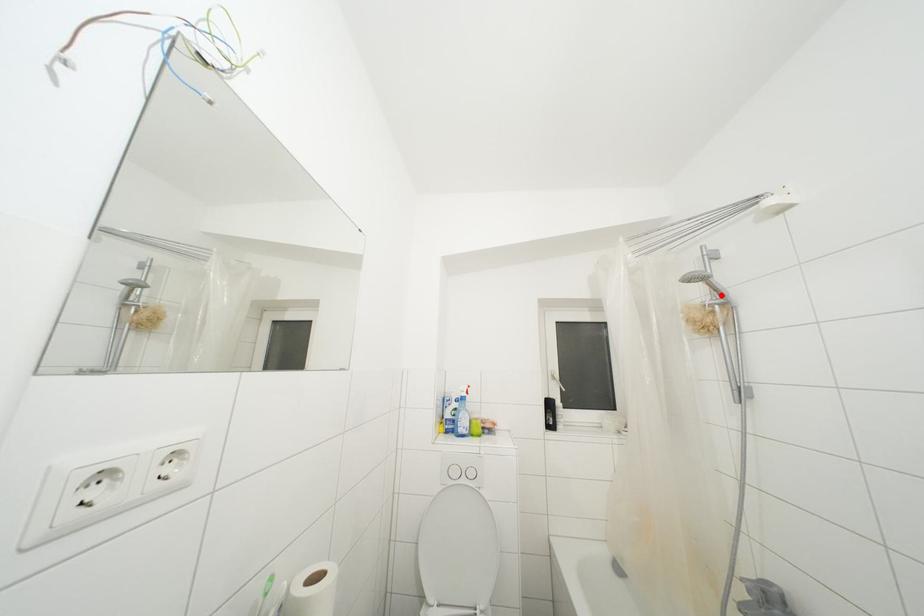
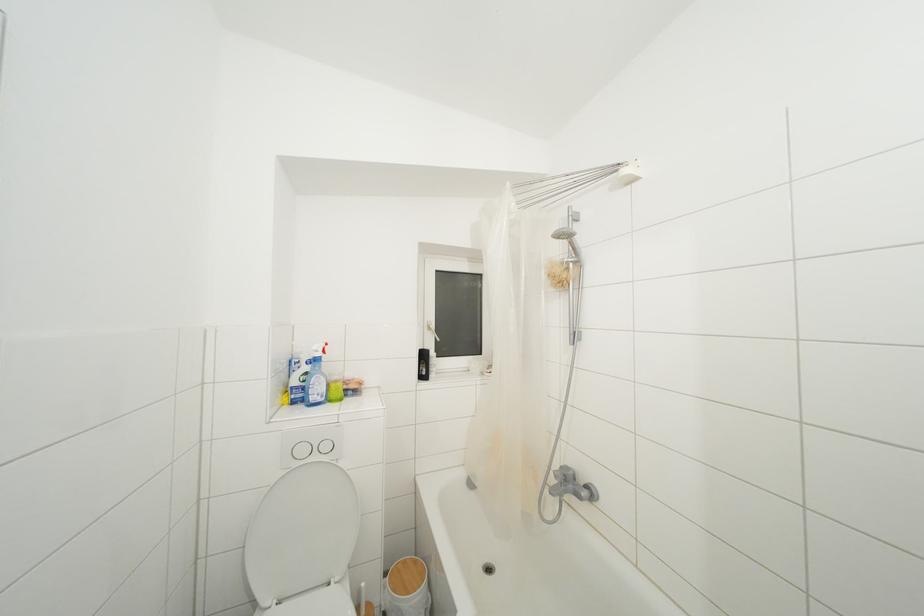
In the second image, find the point that corresponds to the highlighted location in the first image.

(578, 254)